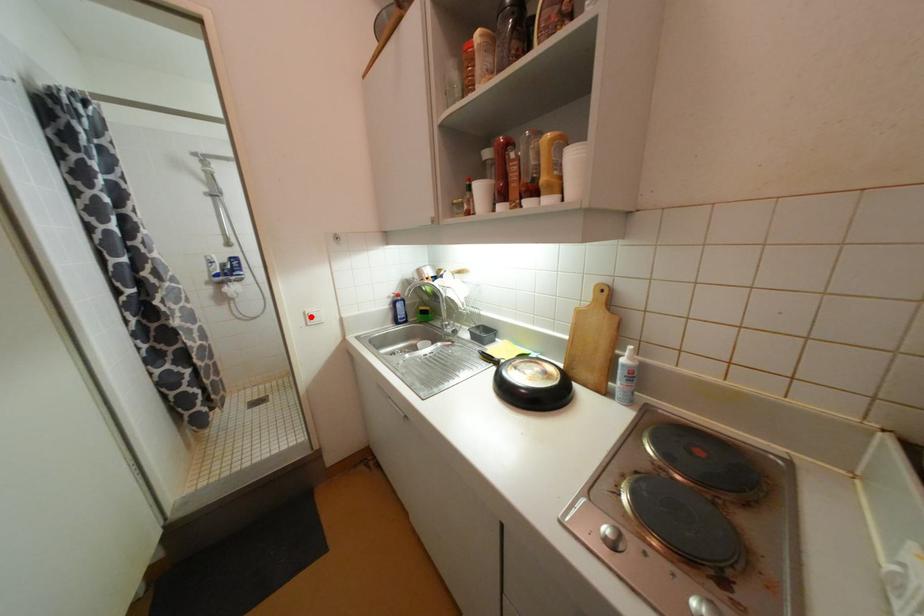
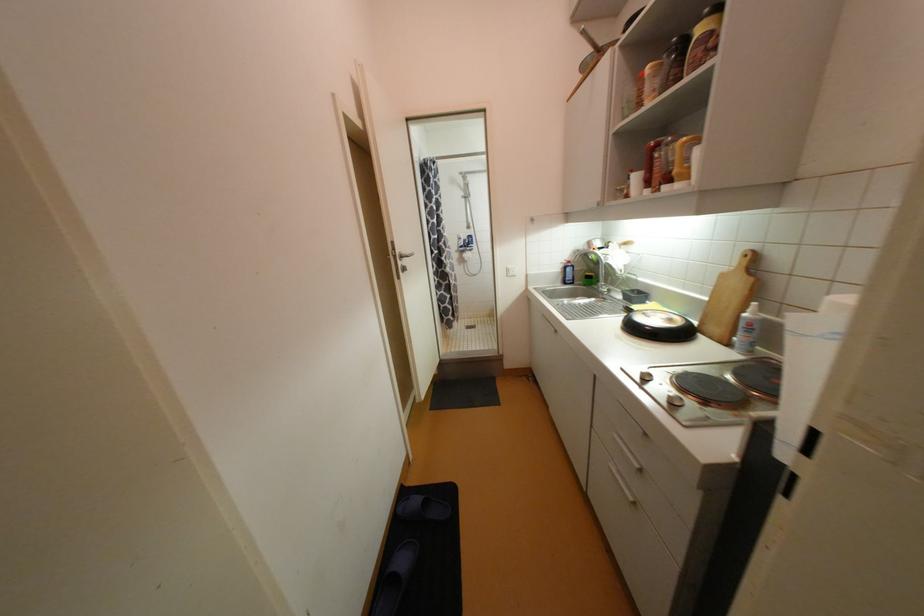
Where in the second image is the point corresponding to the highlighted location from the first image?

(513, 270)